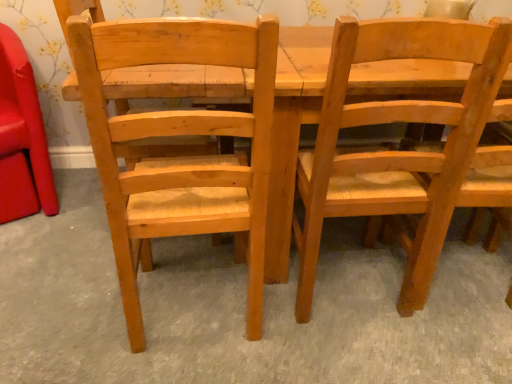
Image resolution: width=512 pixels, height=384 pixels. Identify the location of vacant space situated on the left part of natural wood chair at left, which appears as the second chair when viewed from the left. (67, 313).